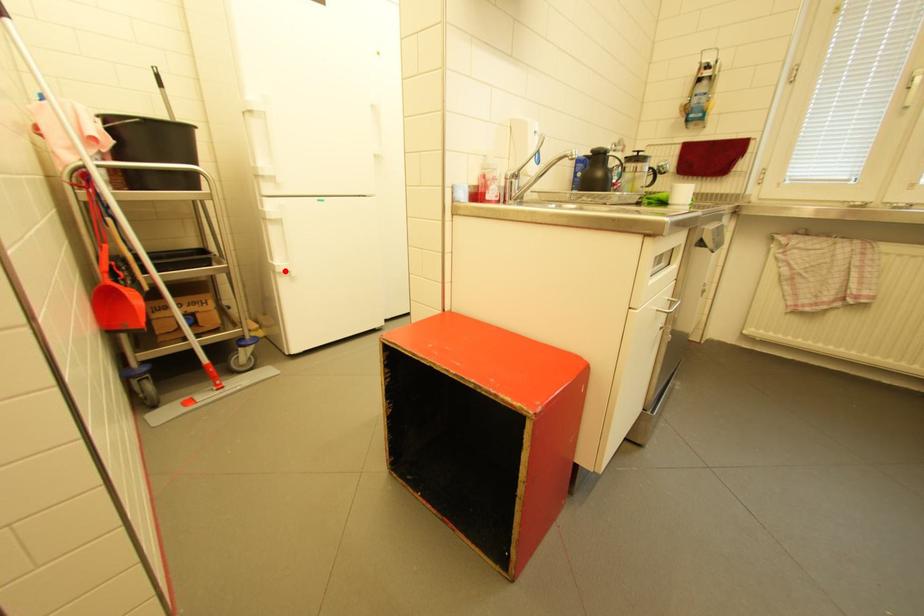
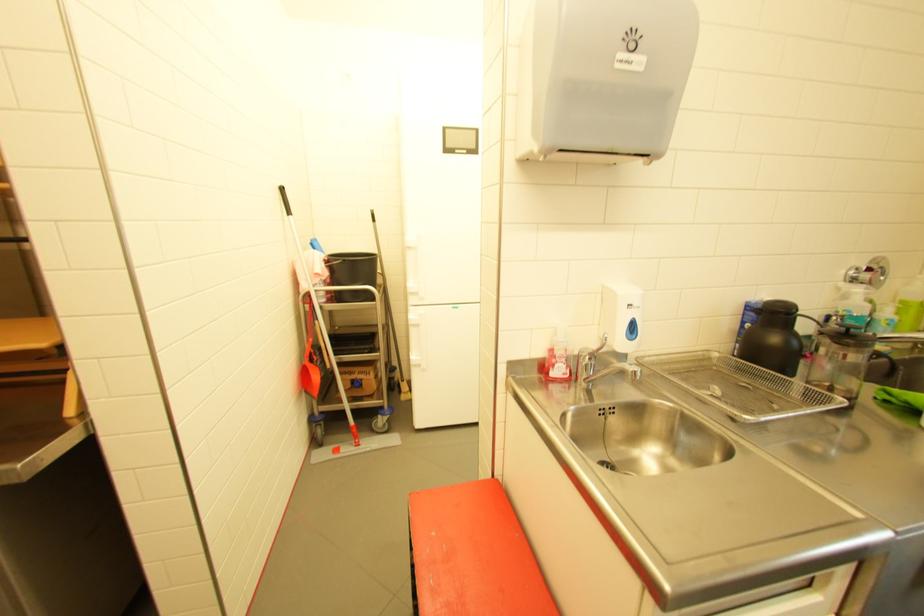
Find the pixel in the second image that matches the highlighted location in the first image.

(419, 363)